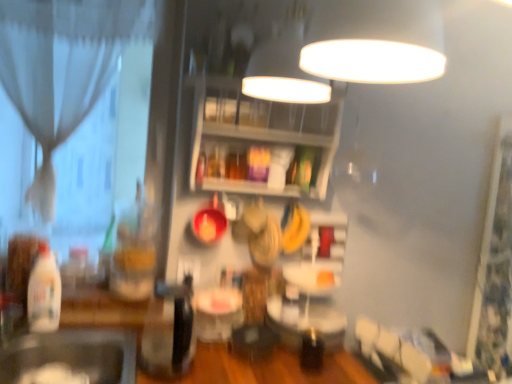
Question: In terms of height, does black matte sink at lower left look taller or shorter compared to white glossy table at center?

Choices:
 (A) short
 (B) tall

Answer: (B)

Question: Relative to white glossy table at center, is black matte sink at lower left in front or behind?

Choices:
 (A) behind
 (B) front

Answer: (B)

Question: Which object is the farthest from the white glossy table at center?

Choices:
 (A) translucent glass jar at center, marked as the 1th bottle in a back-to-front arrangement
 (B) white matte plate at lower left
 (C) translucent plastic bottle at left, the 1th bottle from the front
 (D) wooden shelves at upper center
 (E) white sheer curtain at left

Answer: (E)

Question: Estimate the real-world distances between objects in this image. Which object is closer to the white sheer curtain at left?

Choices:
 (A) translucent plastic bottle at left, the second bottle from the right
 (B) white matte plate at lower left
 (C) translucent glass jar at center, which is counted as the second bottle, starting from the left
 (D) black matte sink at lower left
 (E) wooden shelves at upper center

Answer: (C)